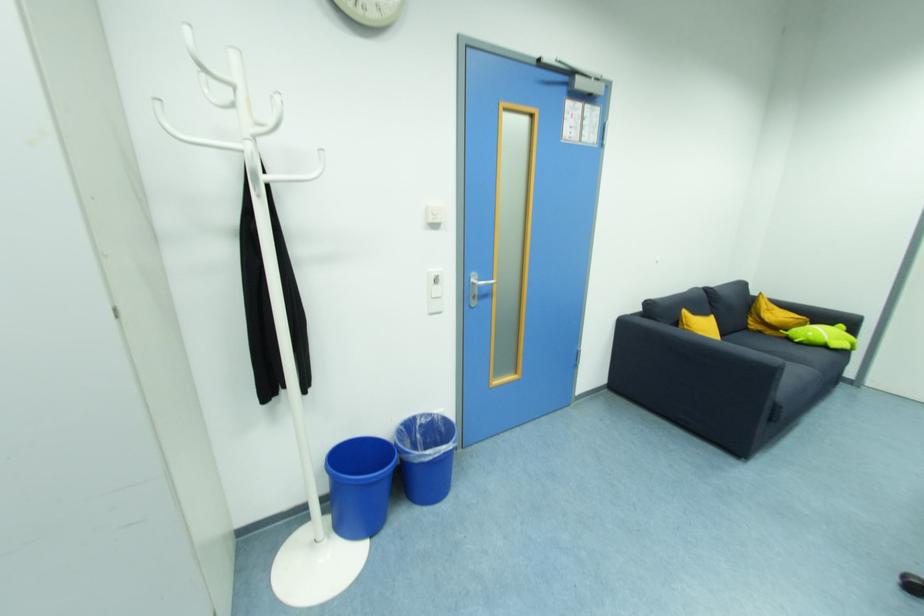
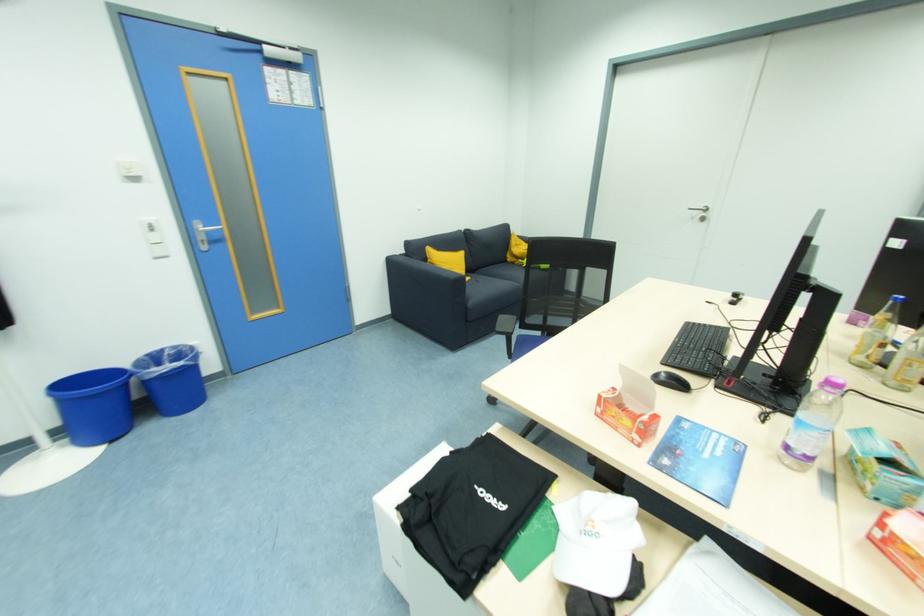
The point at (406, 426) is marked in the first image. Where is the corresponding point in the second image?

(151, 357)